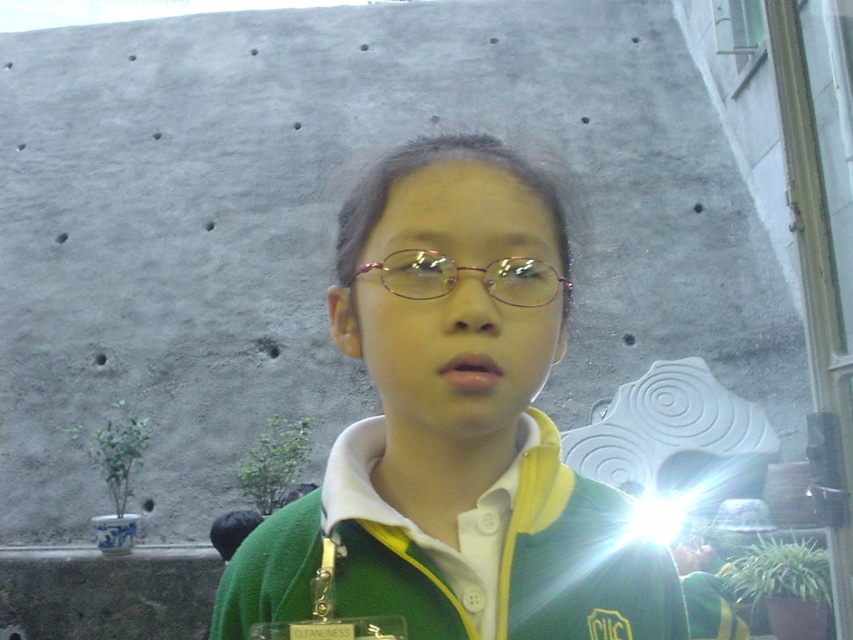
Question: Observing the image, what is the correct spatial positioning of green matte sweater at center in reference to pink metallic glasses at center?

Choices:
 (A) below
 (B) above

Answer: (A)

Question: Does green matte sweater at center have a greater width compared to pink metallic glasses at center?

Choices:
 (A) no
 (B) yes

Answer: (A)

Question: Does green matte sweater at center have a lesser width compared to pink metallic glasses at center?

Choices:
 (A) yes
 (B) no

Answer: (A)